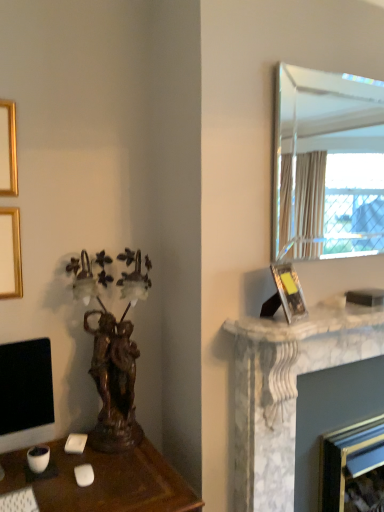
At what (x,y) coordinates should I click in order to perform the action: click on empty space that is ontop of white marble fireplace at right, the 1th fireplace ordered from the bottom. Please return your answer as a coordinate pair (x, y). Looking at the image, I should click on (365, 423).